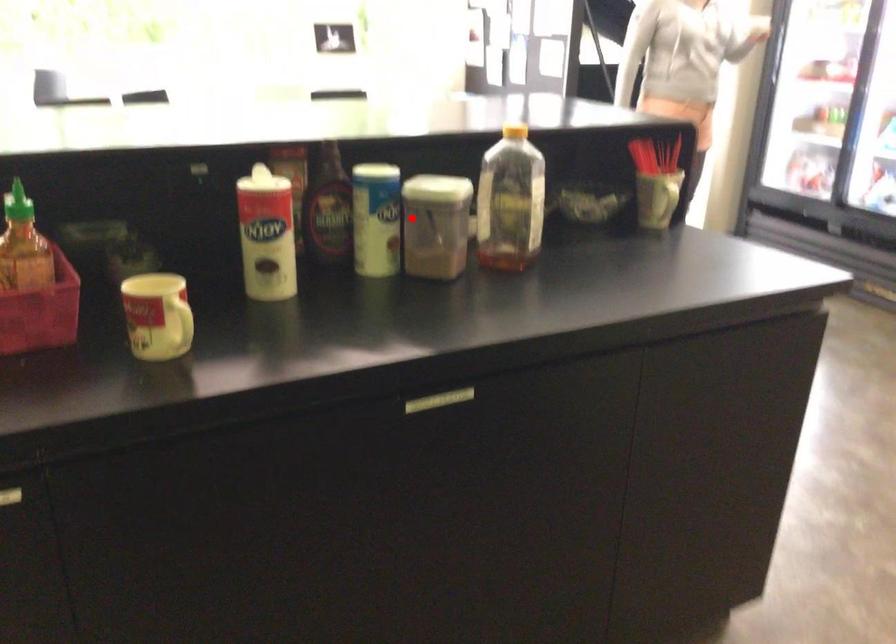
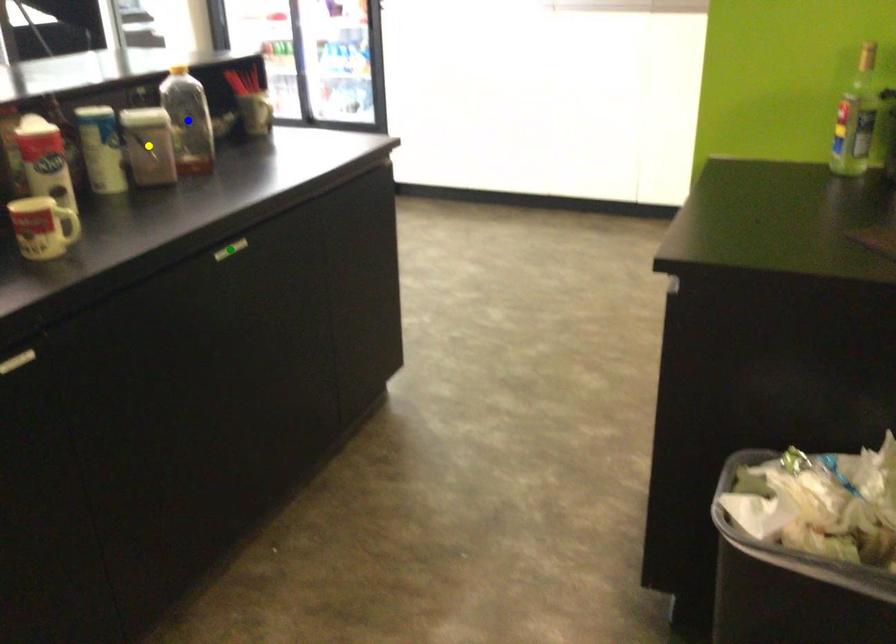
Question: I am providing you with two images of the same scene from different viewpoints. A red point is marked on the first image. You are given multiple points on the second image. Which spot in image 2 lines up with the point in image 1?

Choices:
 (A) green point
 (B) blue point
 (C) yellow point

Answer: (C)